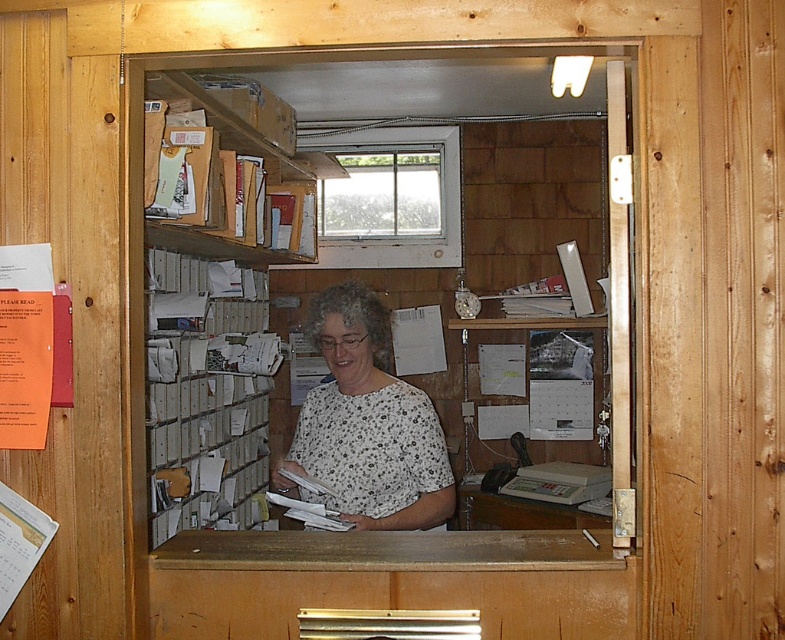
Consider the image. You are a customer in this post office and need to place a large package on the counter. The package is 6 feet long. Is there enough space between the wooden shelves at left and the camera to place the package?

The wooden shelves at left and the camera are 6.59 feet apart from each other, so yes, the package which is 6 feet long can be placed between them as there is sufficient space.

You are a customer standing at the entrance of the post office. You see two points marked in the scene. Which point is closer to you, point (165, 532) or point (261, 140)?

Point (165, 532) is closer to you because it is in front of point (261, 140).

You are a postal worker who needs to place a new stack of forms on the counter. The forms require 90 centimeters of space. Can you fit them between the white paper at left and the clear glass window at upper center?

The distance between the white paper at left and the clear glass window at upper center is 82.55 centimeters. Since the required space is 90 centimeters, the forms will not fit in that area.